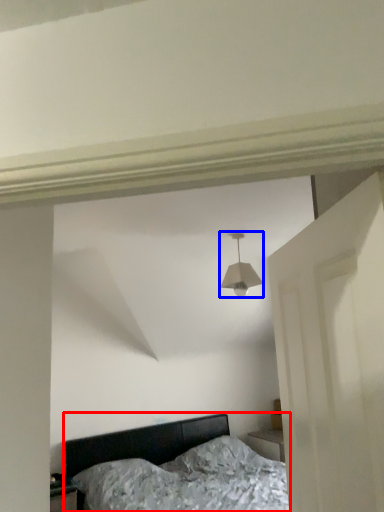
Question: Which object appears closest to the camera in this image, bed (highlighted by a red box) or lamp (highlighted by a blue box)?

Choices:
 (A) bed
 (B) lamp

Answer: (A)